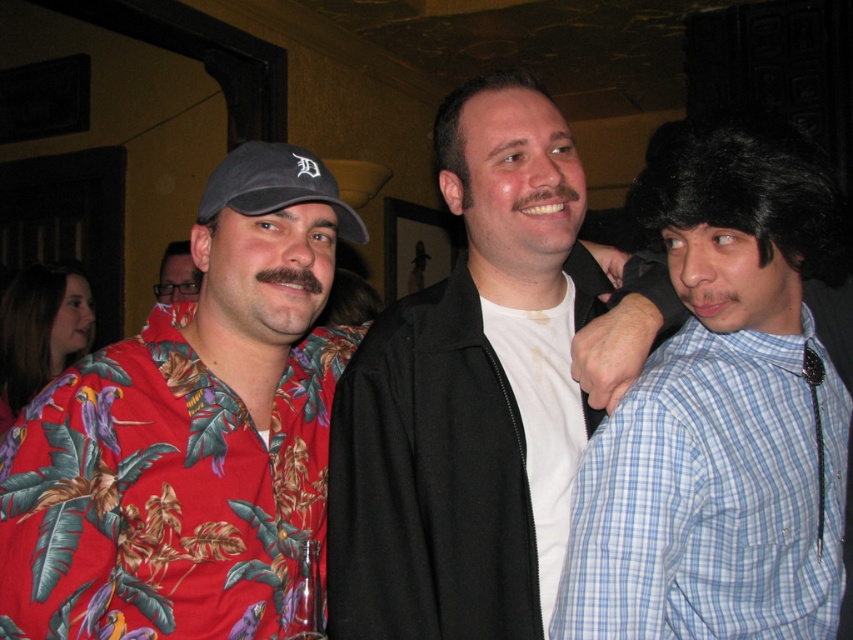
Question: Does floral shirt at center appear over white matte jacket at center?

Choices:
 (A) no
 (B) yes

Answer: (A)

Question: From the image, what is the correct spatial relationship of white matte shirt at center in relation to black fabric baseball cap at left?

Choices:
 (A) left
 (B) right

Answer: (B)

Question: Which object is farther from the camera taking this photo?

Choices:
 (A) black fabric baseball cap at left
 (B) white matte shirt at center

Answer: (A)

Question: Considering the relative positions of white matte jacket at center and white matte shirt at center in the image provided, where is white matte jacket at center located with respect to white matte shirt at center?

Choices:
 (A) right
 (B) left

Answer: (B)

Question: Among these points, which one is nearest to the camera?

Choices:
 (A) (312, 192)
 (B) (521, 308)

Answer: (A)

Question: Which of the following is the closest to the observer?

Choices:
 (A) blue plaid shirt at right
 (B) white matte jacket at center
 (C) floral shirt at center

Answer: (A)